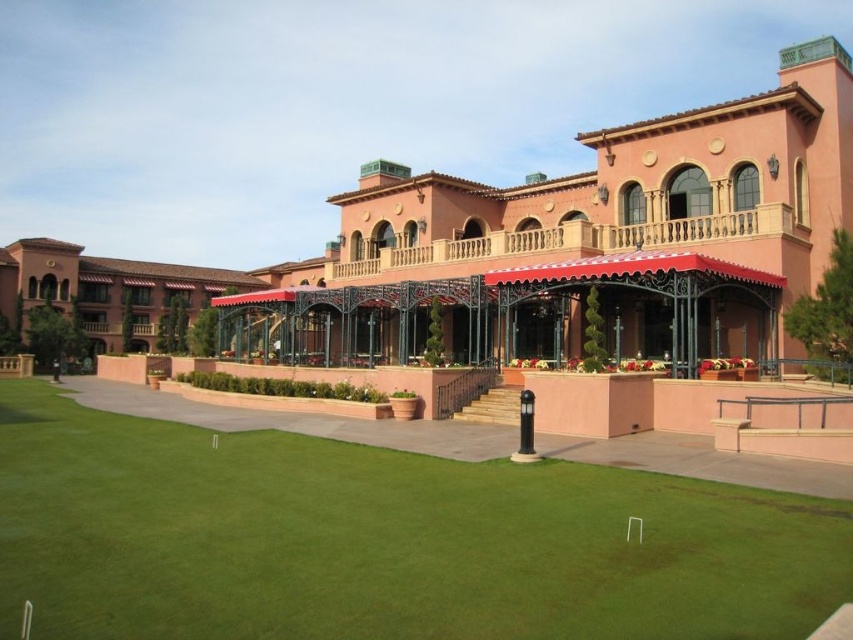
Does green grass at center appear over matte pink awning at center?

No.

Between point (160, 544) and point (192, 312), which one is positioned in front?

Positioned in front is point (160, 544).

Where is `green grass at center`? The image size is (853, 640). green grass at center is located at coordinates (383, 540).